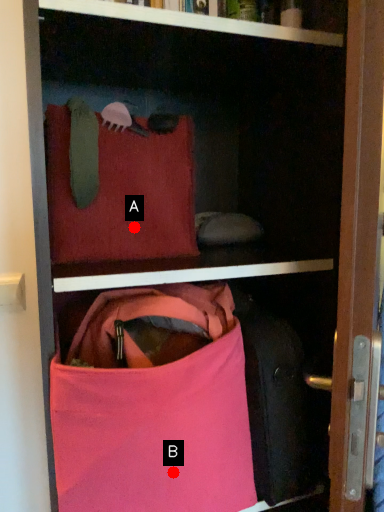
Question: Two points are circled on the image, labeled by A and B beside each circle. Which of the following is the farthest from the observer?

Choices:
 (A) A is further
 (B) B is further

Answer: (A)